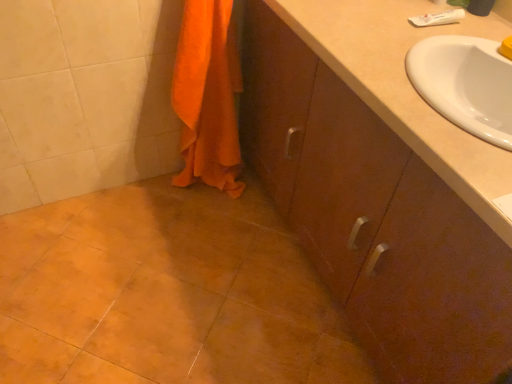
Question: From a real-world perspective, is orange cotton towel at lower left located higher than matte brown cabinet at center?

Choices:
 (A) yes
 (B) no

Answer: (A)

Question: Considering the relative sizes of orange cotton towel at lower left and matte brown cabinet at center in the image provided, is orange cotton towel at lower left taller than matte brown cabinet at center?

Choices:
 (A) yes
 (B) no

Answer: (B)

Question: Can you confirm if orange cotton towel at lower left is wider than matte brown cabinet at center?

Choices:
 (A) yes
 (B) no

Answer: (B)

Question: From a real-world perspective, does orange cotton towel at lower left sit lower than matte brown cabinet at center?

Choices:
 (A) no
 (B) yes

Answer: (A)

Question: Is the depth of orange cotton towel at lower left less than that of matte brown cabinet at center?

Choices:
 (A) yes
 (B) no

Answer: (B)

Question: Is orange cotton towel at lower left surrounding matte brown cabinet at center?

Choices:
 (A) yes
 (B) no

Answer: (B)

Question: Would you say orange cotton towel at lower left is part of matte brown cabinet at center's contents?

Choices:
 (A) yes
 (B) no

Answer: (B)

Question: Does matte brown cabinet at center have a smaller size compared to orange cotton towel at lower left?

Choices:
 (A) no
 (B) yes

Answer: (A)

Question: Can you confirm if matte brown cabinet at center is wider than orange cotton towel at lower left?

Choices:
 (A) yes
 (B) no

Answer: (A)

Question: Does matte brown cabinet at center lie in front of orange cotton towel at lower left?

Choices:
 (A) yes
 (B) no

Answer: (A)

Question: Can you confirm if matte brown cabinet at center is taller than orange cotton towel at lower left?

Choices:
 (A) no
 (B) yes

Answer: (B)

Question: Are matte brown cabinet at center and orange cotton towel at lower left far apart?

Choices:
 (A) yes
 (B) no

Answer: (B)

Question: From the image's perspective, is orange cotton towel at lower left located above or below matte brown cabinet at center?

Choices:
 (A) below
 (B) above

Answer: (B)